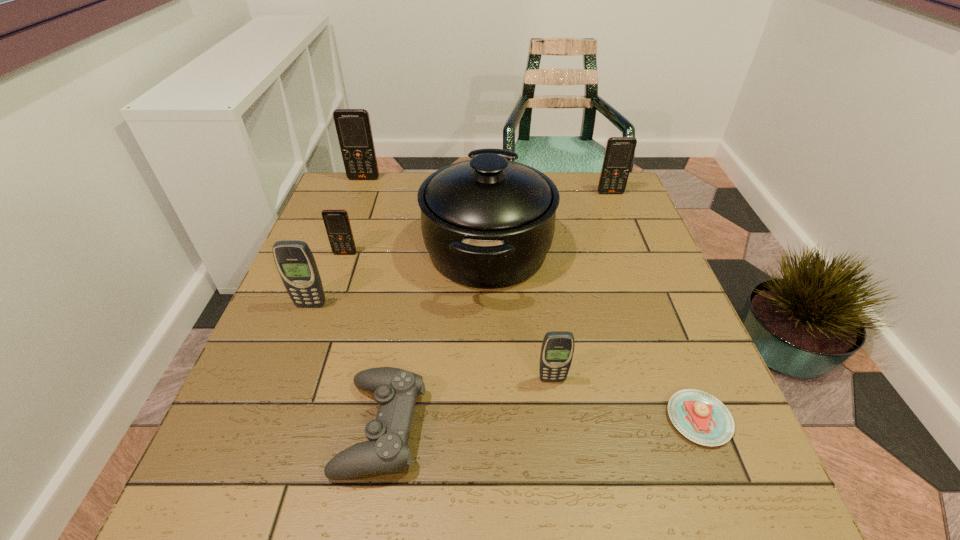
Locate an element on the screen. Image resolution: width=960 pixels, height=540 pixels. saucepan is located at coordinates (488, 223).

At what (x,y) coordinates should I click in order to perform the action: click on the farthest cellular telephone. Please return your answer as a coordinate pair (x, y). This screenshot has width=960, height=540. Looking at the image, I should click on (353, 126).

At what (x,y) coordinates should I click in order to perform the action: click on the farthest object. Please return your answer as a coordinate pair (x, y). Looking at the image, I should click on (353, 126).

In order to click on the fourth farthest cellular telephone in this screenshot , I will do pos(295,262).

Where is `the left gray cellular telephone`? The image size is (960, 540). the left gray cellular telephone is located at coordinates (295, 262).

At what (x,y) coordinates should I click in order to perform the action: click on the second farthest cellular telephone. Please return your answer as a coordinate pair (x, y). The height and width of the screenshot is (540, 960). Looking at the image, I should click on (619, 152).

Identify the location of the second smallest orange cellular telephone. (619, 152).

This screenshot has height=540, width=960. I want to click on the smallest orange cellular telephone, so click(x=336, y=221).

Find the location of a particular element. The width and height of the screenshot is (960, 540). the nearest orange cellular telephone is located at coordinates (336, 221).

Locate an element on the screen. the right gray cellular telephone is located at coordinates (557, 349).